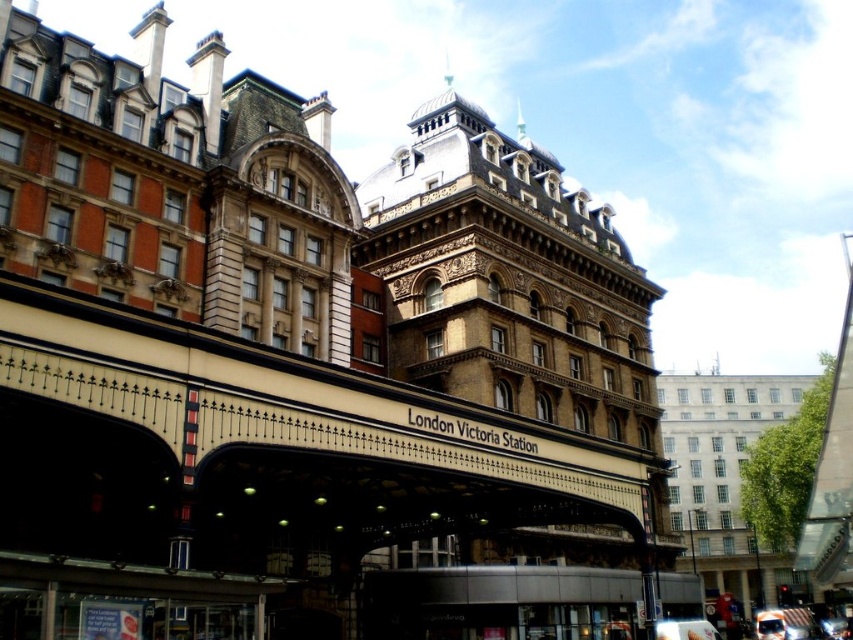
Question: Which point appears farthest from the camera in this image?

Choices:
 (A) (358, 504)
 (B) (776, 625)

Answer: (B)

Question: Is brown textured awning at center above white glossy van at center?

Choices:
 (A) yes
 (B) no

Answer: (A)

Question: Does brown textured awning at center appear under white glossy van at center?

Choices:
 (A) yes
 (B) no

Answer: (B)

Question: Is brown textured awning at center positioned behind white glossy van at center?

Choices:
 (A) no
 (B) yes

Answer: (A)